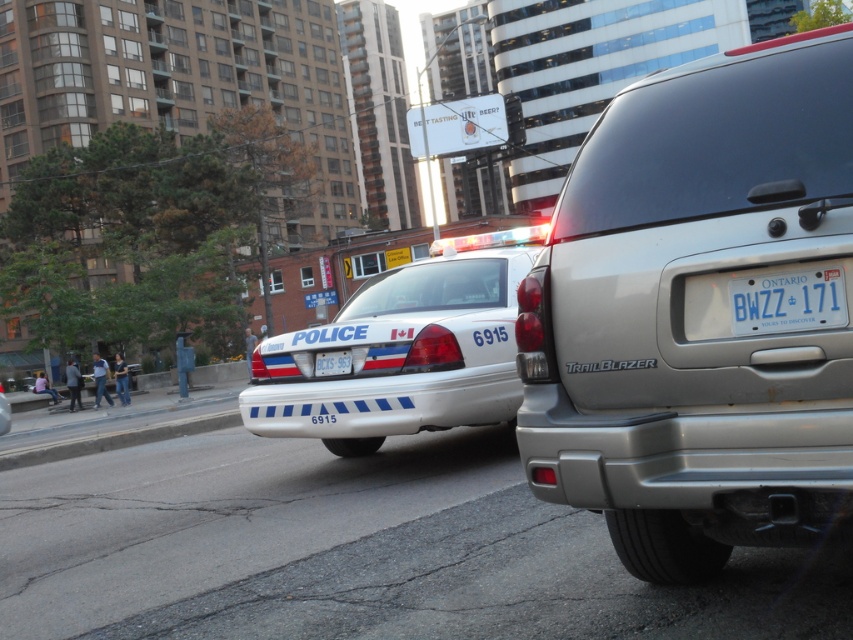
You are a pedestrian standing on the sidewalk and see the silver SUV with license plate BWZZ 171 and the police car behind it. There are two points marked on the road ahead of you. The first point is at coordinates point (432, 337), and the second point is at coordinates point (320, 364). Which point is closer to you?

Point (432, 337) is closer to the viewer than point (320, 364).

Based on the scene description, what are the coordinates of the satin silver suv at center?

The satin silver suv at center is located at coordinates point [695,310].

You are a pedestrian standing on the sidewalk and see the white glossy police car at center and the blue plastic license plate at center. Which object is closer to you?

The white glossy police car at center is closer to you because the blue plastic license plate at center is behind it.